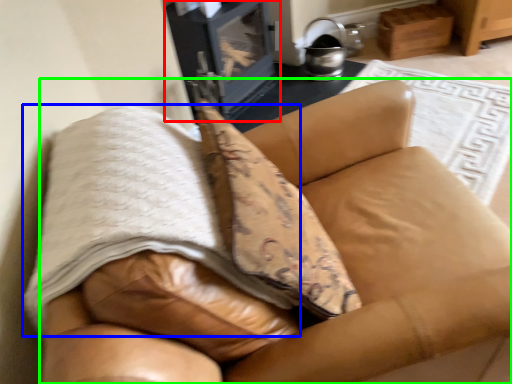
Question: Considering the real-world distances, which object is closest to stove (highlighted by a red box)? blanket (highlighted by a blue box) or furniture (highlighted by a green box).

Choices:
 (A) blanket
 (B) furniture

Answer: (B)